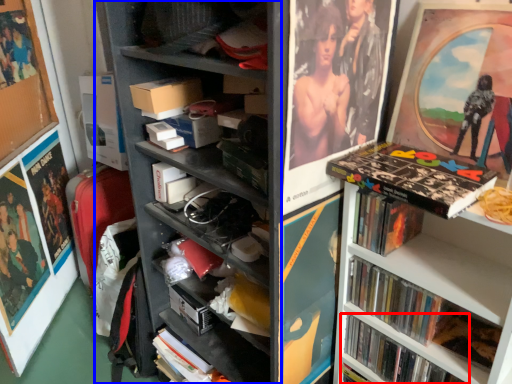
Question: Which object is closer to the camera taking this photo, book (highlighted by a red box) or bookshelf (highlighted by a blue box)?

Choices:
 (A) book
 (B) bookshelf

Answer: (B)